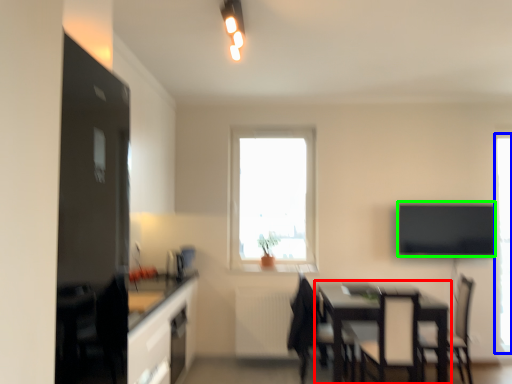
Question: Which is nearer to the table (highlighted by a red box)? window (highlighted by a blue box) or window screen (highlighted by a green box).

Choices:
 (A) window
 (B) window screen

Answer: (B)